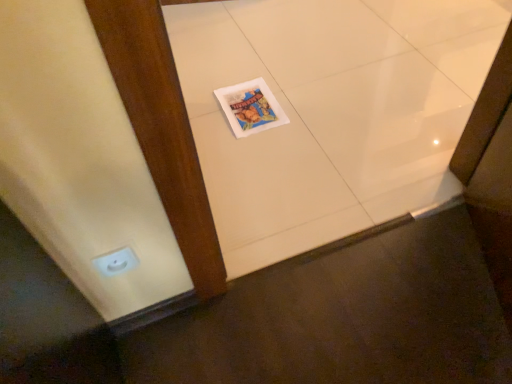
Find the location of a particular element. free space in front of matte paper magazine at center is located at coordinates (260, 150).